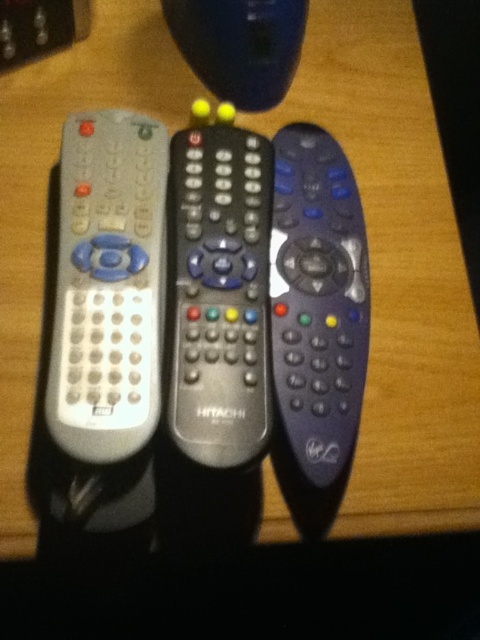
You are organizing a TV setup and need to place the metallic gray remote at center and the matte black remote at center on a shelf. If you want to arrange them from left to right in the same order as shown in the image, which remote should be placed first on the left side?

The metallic gray remote at center should be placed first on the left side because it is positioned to the left of the matte black remote at center in the image.

You are organizing a TV setup and need to place the white matte remote at left and the metallic gray remote at center on a shelf. If the shelf has limited space, which remote should you place first to ensure both fit properly?

The white matte remote at left should be placed first since it is positioned over the metallic gray remote at center, indicating it takes up more space or is larger in size.